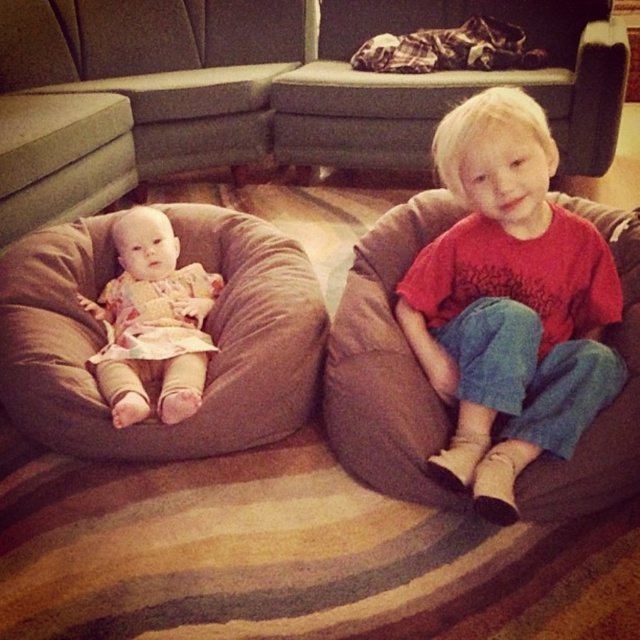
Does brown fabric couch at center appear over brown soft bean bag chair at left?

Yes.

Between point (218, 49) and point (52, 291), which one is positioned in front?

Positioned in front is point (52, 291).

You are a GUI agent. You are given a task and a screenshot of the screen. Output one action in this format:
    pyautogui.click(x=<x>, y=<y>)
    Task: Click on the brown fabric couch at center
    This screenshot has height=640, width=640.
    Given the screenshot: What is the action you would take?
    pyautogui.click(x=260, y=90)

Is point (326, 160) in front of point (140, 410)?

No, it is not.

Is point (132, 120) positioned after point (170, 316)?

Yes, it is.

This screenshot has height=640, width=640. I want to click on brown fabric couch at center, so click(x=260, y=90).

Is point (432, 461) farther from viewer compared to point (70, 445)?

No, it is not.

Between point (518, 115) and point (48, 310), which one is positioned in front?

Point (518, 115) is more forward.

Measure the distance between matte red shirt at center and camera.

The distance of matte red shirt at center from camera is 3.89 feet.

Identify the location of matte red shirt at center. (509, 301).